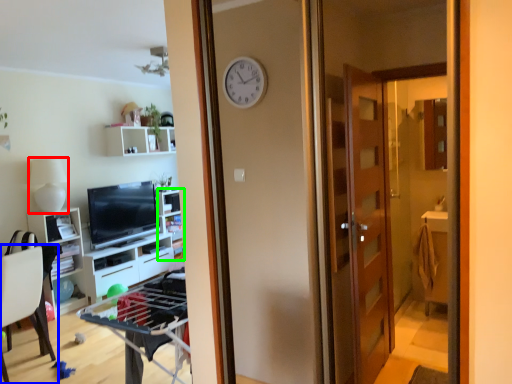
Question: Which object is the farthest from lamp (highlighted by a red box)? Choose among these: chair (highlighted by a blue box) or shelf (highlighted by a green box).

Choices:
 (A) chair
 (B) shelf

Answer: (B)